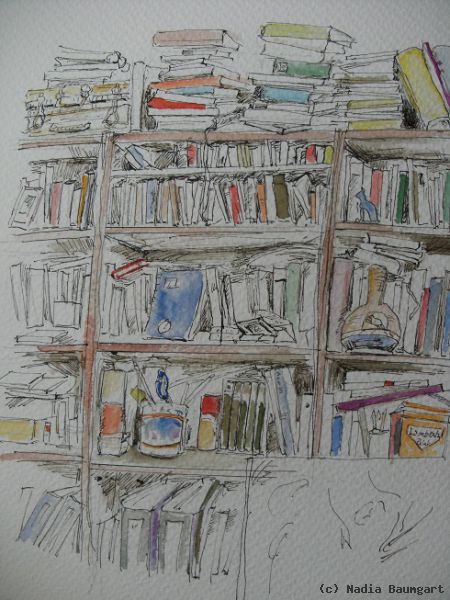
This screenshot has height=600, width=450. Identify the location of bookshelf. (282, 297).